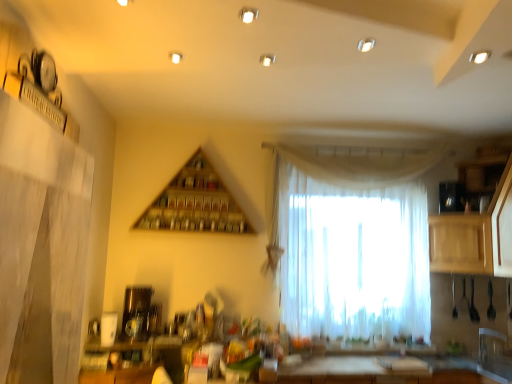
The width and height of the screenshot is (512, 384). What do you see at coordinates (195, 203) in the screenshot? I see `wooden triangle at upper center` at bounding box center [195, 203].

Image resolution: width=512 pixels, height=384 pixels. Find the location of `light wood cabinet at right, the 2th cabinetry in the back-to-front sequence`. light wood cabinet at right, the 2th cabinetry in the back-to-front sequence is located at coordinates (470, 237).

The width and height of the screenshot is (512, 384). I want to click on wooden cabinet at right, which is the second cabinetry in front-to-back order, so (x=461, y=244).

Where is `wooden triangle at upper center`? wooden triangle at upper center is located at coordinates (195, 203).

Is light wood cabinet at right, the 2th cabinetry in the back-to-front sequence, shorter than wooden triangle at upper center?

Incorrect, the height of light wood cabinet at right, the 2th cabinetry in the back-to-front sequence, does not fall short of that of wooden triangle at upper center.

Could you tell me if light wood cabinet at right, the 2th cabinetry in the back-to-front sequence, is facing wooden triangle at upper center?

Yes, light wood cabinet at right, the 2th cabinetry in the back-to-front sequence, is aimed at wooden triangle at upper center.

From the image's perspective, which one is positioned lower, light wood cabinet at right, the 2th cabinetry in the back-to-front sequence, or wooden triangle at upper center?

light wood cabinet at right, the 2th cabinetry in the back-to-front sequence, is shown below in the image.

What's the angular difference between wooden triangle at upper center and white sheer curtain at center's facing directions?

There is a 1.08-degree angle between the facing directions of wooden triangle at upper center and white sheer curtain at center.

Is wooden triangle at upper center beside white sheer curtain at center?

No, wooden triangle at upper center is not touching white sheer curtain at center.

Does wooden triangle at upper center appear on the right side of white sheer curtain at center?

In fact, wooden triangle at upper center is to the left of white sheer curtain at center.

Which object is closer to the camera, wooden triangle at upper center or white sheer curtain at center?

wooden triangle at upper center.

Is light wood cabinet at right, which is counted as the 1th cabinetry, starting from the front, next to satin gold coffee maker at lower left and touching it?

light wood cabinet at right, which is counted as the 1th cabinetry, starting from the front, and satin gold coffee maker at lower left are clearly separated.

Image resolution: width=512 pixels, height=384 pixels. Identify the location of appliance that is below the light wood cabinet at right, which is counted as the 1th cabinetry, starting from the front (from the image's perspective). (136, 312).

Considering the relative sizes of light wood cabinet at right, the 2th cabinetry in the back-to-front sequence, and satin gold coffee maker at lower left in the image provided, is light wood cabinet at right, the 2th cabinetry in the back-to-front sequence, smaller than satin gold coffee maker at lower left?

No, light wood cabinet at right, the 2th cabinetry in the back-to-front sequence, is not smaller than satin gold coffee maker at lower left.

Is light wood cabinet at right, the 2th cabinetry in the back-to-front sequence, a part of wooden cabinet at right, which is the second cabinetry in front-to-back order?

No.

Locate an element on the screen. This screenshot has height=384, width=512. cabinetry lying behind the light wood cabinet at right, which is counted as the 1th cabinetry, starting from the front is located at coordinates (461, 244).

Which point is more forward, (434,226) or (473,248)?

The point (473,248) is closer.

Does wooden cabinet at right, which is the second cabinetry in front-to-back order, have a larger size compared to light wood cabinet at right, which is counted as the 1th cabinetry, starting from the front?

Actually, wooden cabinet at right, which is the second cabinetry in front-to-back order, might be smaller than light wood cabinet at right, which is counted as the 1th cabinetry, starting from the front.

At what (x,y) coordinates should I click in order to perform the action: click on appliance below the wooden triangle at upper center (from a real-world perspective). Please return your answer as a coordinate pair (x, y). Looking at the image, I should click on (136, 312).

Is satin gold coffee maker at lower left positioned beyond the bounds of wooden triangle at upper center?

That's correct, satin gold coffee maker at lower left is outside of wooden triangle at upper center.

From a real-world perspective, is satin gold coffee maker at lower left above or below wooden triangle at upper center?

satin gold coffee maker at lower left is situated lower than wooden triangle at upper center in the real world.

Who is bigger, white sheer curtain at center or wooden cabinet at right, arranged as the 1th cabinetry when viewed from the back?

With larger size is wooden cabinet at right, arranged as the 1th cabinetry when viewed from the back.

Is point (417, 250) closer or farther from the camera than point (454, 228)?

Point (417, 250) is positioned farther from the camera compared to point (454, 228).

Is white sheer curtain at center placed right next to wooden cabinet at right, arranged as the 1th cabinetry when viewed from the back?

white sheer curtain at center is not next to wooden cabinet at right, arranged as the 1th cabinetry when viewed from the back, and they're not touching.

Which is closer to the camera, (x=212, y=188) or (x=473, y=254)?

The point (x=473, y=254) is in front.

Is wooden triangle at upper center in front of or behind wooden cabinet at right, arranged as the 1th cabinetry when viewed from the back, in the image?

Visually, wooden triangle at upper center is located behind wooden cabinet at right, arranged as the 1th cabinetry when viewed from the back.

From a real-world perspective, is wooden triangle at upper center below wooden cabinet at right, arranged as the 1th cabinetry when viewed from the back?

No, from a real-world perspective, wooden triangle at upper center is not beneath wooden cabinet at right, arranged as the 1th cabinetry when viewed from the back.

Identify the location of the 1st cabinetry below when counting from the wooden triangle at upper center (from the image's perspective). The width and height of the screenshot is (512, 384). (470, 237).

Identify the location of shelf in front of the white sheer curtain at center. tap(195, 203).

Looking at the image, which one is located closer to wooden triangle at upper center, light wood cabinet at right, which is counted as the 1th cabinetry, starting from the front, or satin gold coffee maker at lower left?

satin gold coffee maker at lower left is positioned closer to the anchor wooden triangle at upper center.

Estimate the real-world distances between objects in this image. Which object is further from wooden cabinet at right, arranged as the 1th cabinetry when viewed from the back, light wood cabinet at right, the 2th cabinetry in the back-to-front sequence, or wooden triangle at upper center?

wooden triangle at upper center is further to wooden cabinet at right, arranged as the 1th cabinetry when viewed from the back.

When comparing their distances from light wood cabinet at right, which is counted as the 1th cabinetry, starting from the front, does satin gold coffee maker at lower left or wooden cabinet at right, arranged as the 1th cabinetry when viewed from the back, seem closer?

wooden cabinet at right, arranged as the 1th cabinetry when viewed from the back.

Estimate the real-world distances between objects in this image. Which object is further from satin gold coffee maker at lower left, wooden triangle at upper center or light wood cabinet at right, the 2th cabinetry in the back-to-front sequence?

Based on the image, light wood cabinet at right, the 2th cabinetry in the back-to-front sequence, appears to be further to satin gold coffee maker at lower left.

Based on their spatial positions, is wooden cabinet at right, which is the second cabinetry in front-to-back order, or light wood cabinet at right, which is counted as the 1th cabinetry, starting from the front, closer to white sheer curtain at center?

The object closer to white sheer curtain at center is wooden cabinet at right, which is the second cabinetry in front-to-back order.

When comparing their distances from light wood cabinet at right, the 2th cabinetry in the back-to-front sequence, does wooden cabinet at right, arranged as the 1th cabinetry when viewed from the back, or white sheer curtain at center seem further?

Based on the image, white sheer curtain at center appears to be further to light wood cabinet at right, the 2th cabinetry in the back-to-front sequence.

From the image, which object appears to be farther from white sheer curtain at center, wooden triangle at upper center or wooden cabinet at right, which is the second cabinetry in front-to-back order?

wooden triangle at upper center lies further to white sheer curtain at center than the other object.

Considering their positions, is white sheer curtain at center positioned further to light wood cabinet at right, the 2th cabinetry in the back-to-front sequence, than wooden triangle at upper center?

Based on the image, wooden triangle at upper center appears to be further to light wood cabinet at right, the 2th cabinetry in the back-to-front sequence.

You are a GUI agent. You are given a task and a screenshot of the screen. Output one action in this format:
    pyautogui.click(x=<x>, y=<y>)
    Task: Click on the curtain between satin gold coffee maker at lower left and light wood cabinet at right, which is counted as the 1th cabinetry, starting from the front
    Image resolution: width=512 pixels, height=384 pixels.
    Given the screenshot: What is the action you would take?
    pyautogui.click(x=351, y=257)

At what (x,y) coordinates should I click in order to perform the action: click on shelf located between satin gold coffee maker at lower left and white sheer curtain at center in the left-right direction. Please return your answer as a coordinate pair (x, y). This screenshot has width=512, height=384. Looking at the image, I should click on (195, 203).

Locate an element on the screen. Image resolution: width=512 pixels, height=384 pixels. curtain between satin gold coffee maker at lower left and wooden cabinet at right, arranged as the 1th cabinetry when viewed from the back is located at coordinates (351, 257).

Locate an element on the screen. cabinetry between wooden triangle at upper center and light wood cabinet at right, which is counted as the 1th cabinetry, starting from the front is located at coordinates (461, 244).